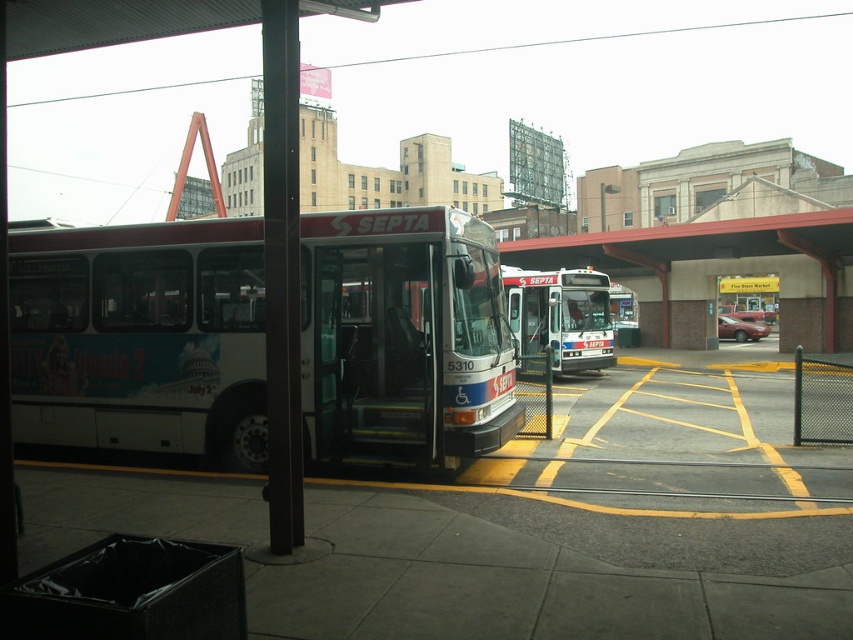
Question: Does white matte bus at center have a smaller size compared to white glossy bus at center?

Choices:
 (A) yes
 (B) no

Answer: (A)

Question: Can you confirm if white matte bus at center is positioned to the right of white glossy bus at center?

Choices:
 (A) no
 (B) yes

Answer: (A)

Question: Which object appears farthest from the camera in this image?

Choices:
 (A) white glossy bus at center
 (B) white matte bus at center

Answer: (A)

Question: Is white matte bus at center above white glossy bus at center?

Choices:
 (A) no
 (B) yes

Answer: (A)